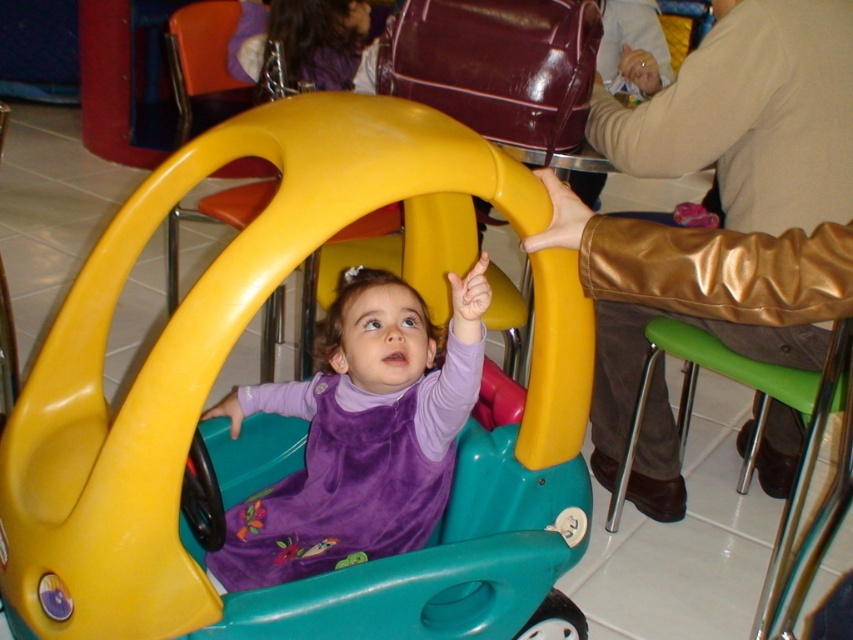
In the scene described, the child is sitting inside a toy car. From the perspective of the purple velvet toddler at center, where is the matte plastic toy car at center located?

The matte plastic toy car at center is to the right of the purple velvet toddler at center.

You are a parent trying to locate your child who is sitting in a toy car. You see the point at coordinates (213, 381). What is located at that point?

The point at coordinates (213, 381) has a matte plastic toy car at center.

You are standing in a play area and see two points marked in the image. Which point, point (235, 605) or point (347, 468), is closer to you?

Point (235, 605) is closer to the viewer than point (347, 468).